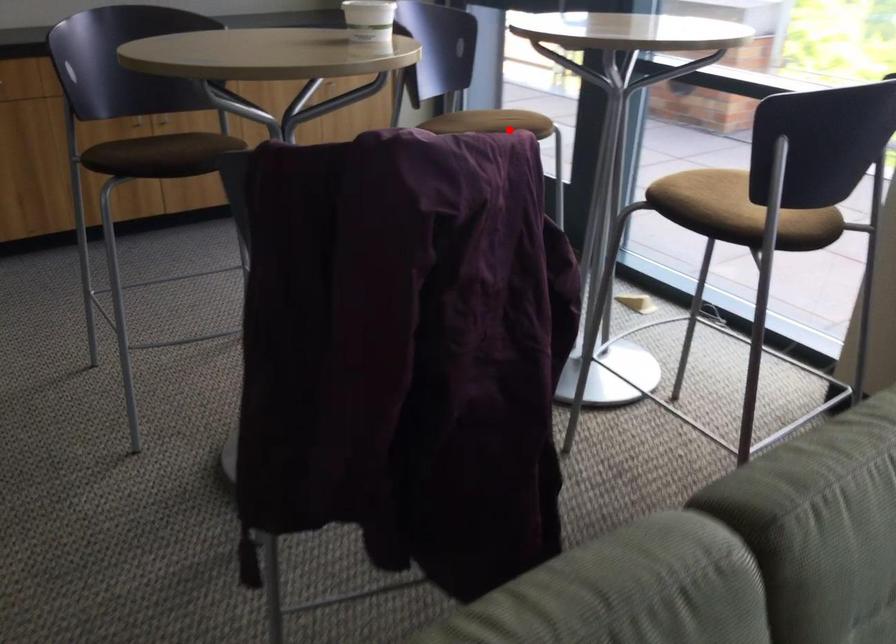
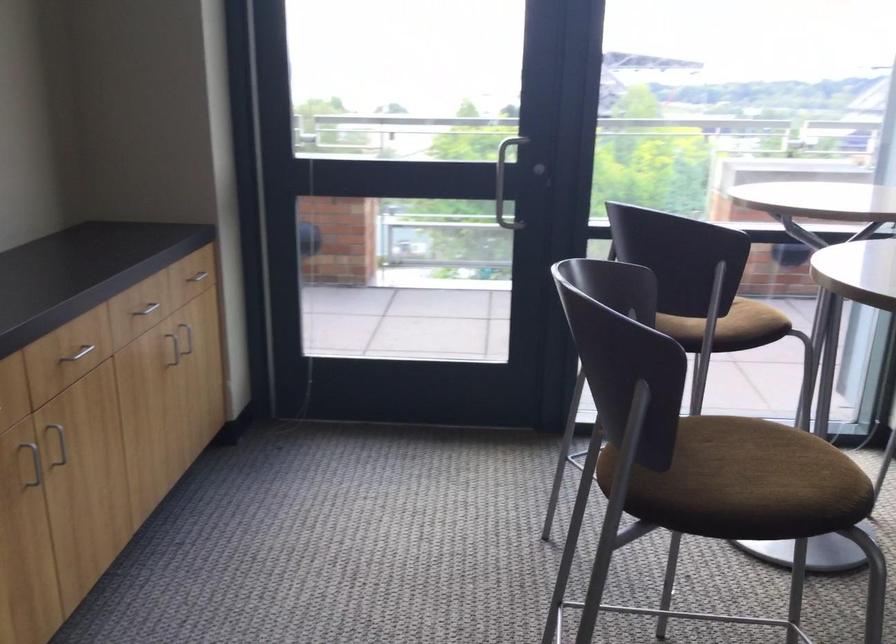
Where in the second image is the point corresponding to the highlighted location from the first image?

(748, 319)